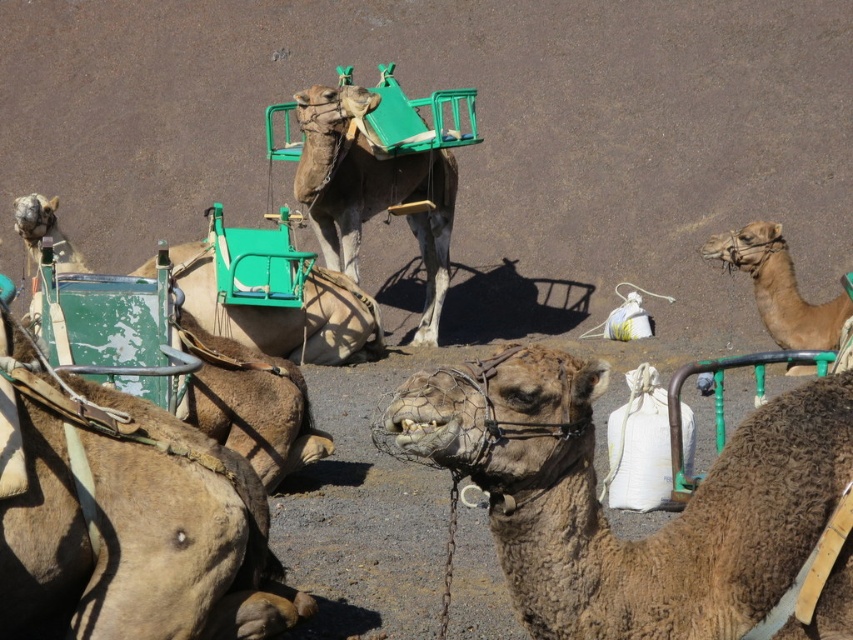
Is brown fuzzy camel at center taller than brown textured camel at center?

No.

Which is more to the left, brown fuzzy camel at center or brown textured camel at center?

brown textured camel at center

Who is more forward, (683, 564) or (445, 236)?

Point (683, 564) is in front.

The image size is (853, 640). Identify the location of brown fuzzy camel at center. (601, 506).

Which is in front, point (53, 545) or point (334, 118)?

Point (53, 545) is more forward.

The height and width of the screenshot is (640, 853). I want to click on brown rough camel at center, so click(129, 516).

Does point (367, 164) come farther from viewer compared to point (190, 276)?

Yes, it is behind point (190, 276).

Which is below, brown textured camel at center or light brown leather camel at upper left?

light brown leather camel at upper left is lower down.

Who is more forward, (369, 179) or (135, 275)?

Point (135, 275)

Find the location of a particular element. The height and width of the screenshot is (640, 853). brown textured camel at center is located at coordinates (370, 189).